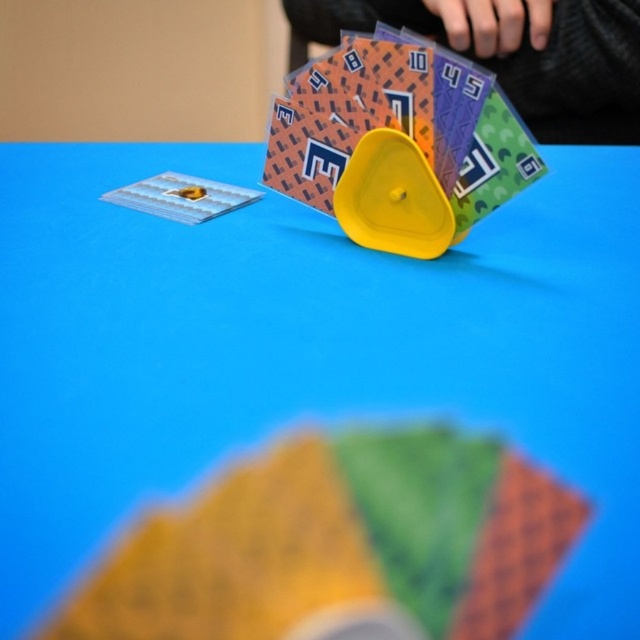
Which of these two, matte plastic cards at center or yellow plastic triangle at center, stands shorter?

With less height is matte plastic cards at center.

Which is above, matte plastic cards at center or yellow plastic triangle at center?

yellow plastic triangle at center is higher up.

Locate an element on the screen. This screenshot has width=640, height=640. matte plastic cards at center is located at coordinates (339, 545).

Where is `matte plastic cards at center`? matte plastic cards at center is located at coordinates (339, 545).